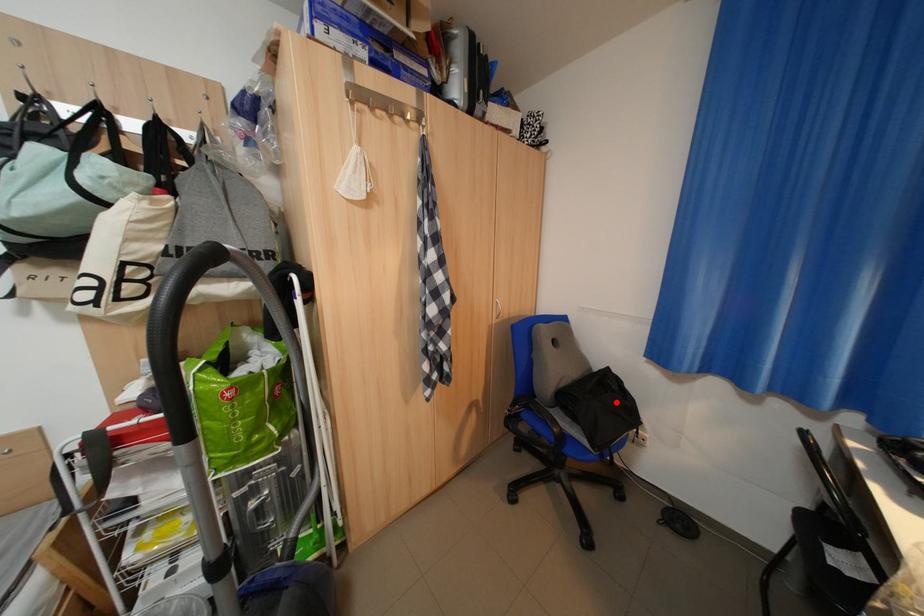
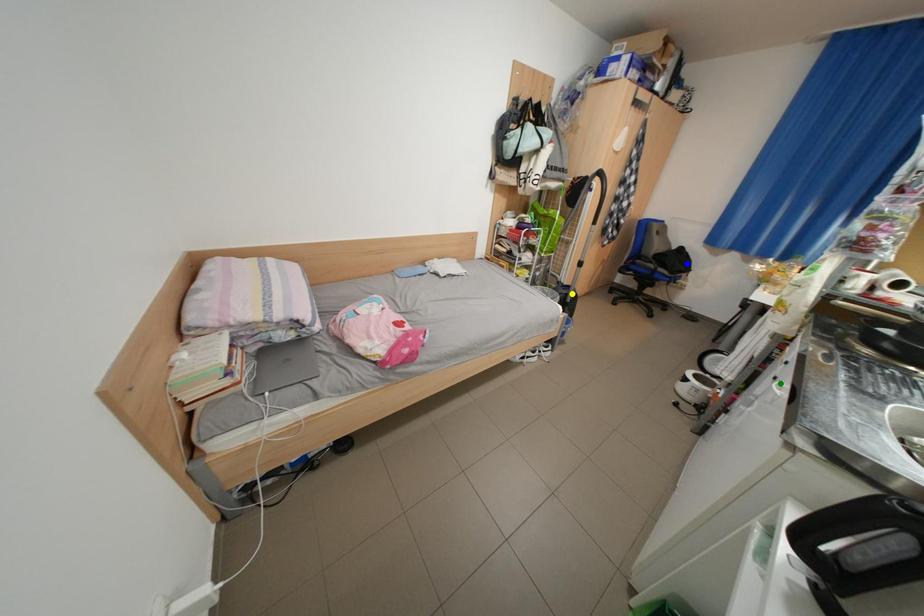
Question: I am providing you with two images of the same scene from different viewpoints. A red point is marked on the first image. You are given multiple points on the second image. Can you choose the point in image 2 that corresponds to the point in image 1?

Choices:
 (A) yellow point
 (B) green point
 (C) blue point

Answer: (C)